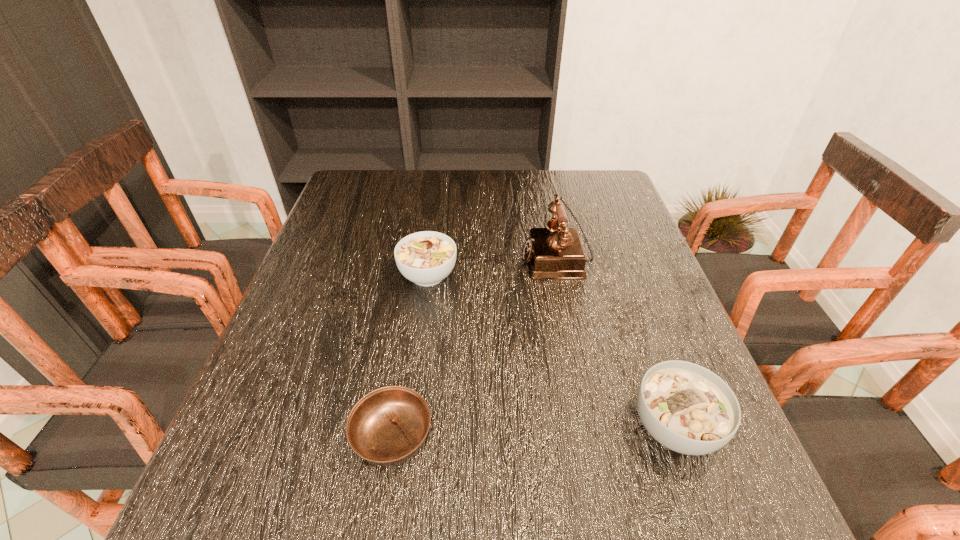
Where is `free spot between the tallest object and the shortest soup bowl`? The width and height of the screenshot is (960, 540). free spot between the tallest object and the shortest soup bowl is located at coordinates (474, 347).

The image size is (960, 540). What are the coordinates of `unoccupied area between the telephone and the farthest soup bowl` in the screenshot? It's located at (492, 266).

I want to click on unoccupied position between the tallest object and the farthest soup bowl, so click(x=492, y=266).

At what (x,y) coordinates should I click in order to perform the action: click on vacant region between the shortest soup bowl and the farthest soup bowl. Please return your answer as a coordinate pair (x, y). Image resolution: width=960 pixels, height=540 pixels. Looking at the image, I should click on (410, 355).

Identify the location of vacant area that lies between the rightmost soup bowl and the farthest soup bowl. Image resolution: width=960 pixels, height=540 pixels. click(551, 351).

Identify the location of free space that is in between the rightmost soup bowl and the shortest object. (534, 431).

The image size is (960, 540). I want to click on vacant space that is in between the tallest object and the farthest soup bowl, so click(492, 266).

You are a GUI agent. You are given a task and a screenshot of the screen. Output one action in this format:
    pyautogui.click(x=<x>, y=<y>)
    Task: Click on the blank region between the shortest object and the farthest soup bowl
    Image resolution: width=960 pixels, height=540 pixels.
    Given the screenshot: What is the action you would take?
    point(410,355)

Image resolution: width=960 pixels, height=540 pixels. What are the coordinates of `object that stands as the closest to the farthest soup bowl` in the screenshot? It's located at (556, 252).

Identify which object is located as the nearest to the shortest soup bowl. Please provide its 2D coordinates. Your answer should be formatted as a tuple, i.e. [(x, y)], where the tuple contains the x and y coordinates of a point satisfying the conditions above.

[(426, 258)]